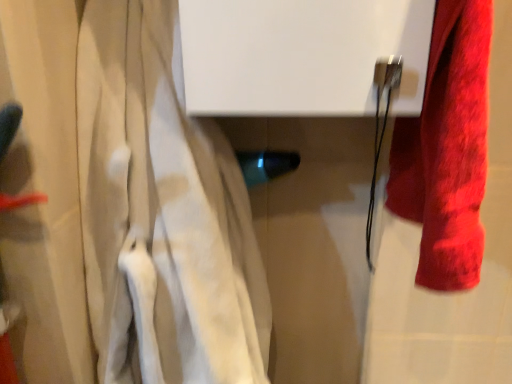
Question: Should I look upward or downward to see velvet red towel at right?

Choices:
 (A) up
 (B) down

Answer: (A)